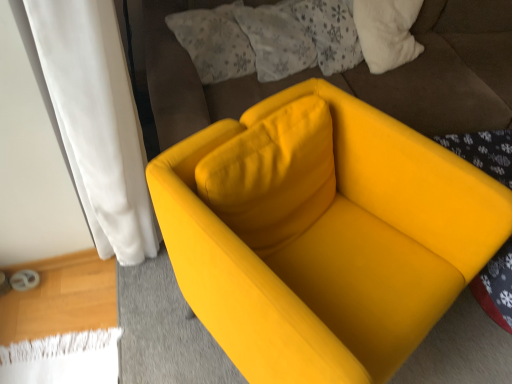
The width and height of the screenshot is (512, 384). I want to click on fluffy white pillow at upper center, the 1th pillow viewed from the right, so click(x=276, y=40).

Identify the location of matte yellow armchair at center. The width and height of the screenshot is (512, 384). (447, 71).

I want to click on fluffy white pillow at upper center, the 1th pillow viewed from the right, so click(276, 40).

Based on their sizes in the image, would you say matte yellow armchair at center is bigger or smaller than matte yellow armchair at center?

Clearly, matte yellow armchair at center is smaller in size than matte yellow armchair at center.

Which is behind, matte yellow armchair at center or matte yellow armchair at center?

matte yellow armchair at center.

Do you think matte yellow armchair at center is within matte yellow armchair at center, or outside of it?

matte yellow armchair at center is located beyond the bounds of matte yellow armchair at center.

Is point (358, 162) farther from camera compared to point (144, 35)?

No, (358, 162) is closer to viewer.

Can you confirm if fluffy white pillow at upper center, placed as the 1th pillow when sorted from left to right, is bigger than matte yellow armchair at center?

Incorrect, fluffy white pillow at upper center, placed as the 1th pillow when sorted from left to right, is not larger than matte yellow armchair at center.

Is fluffy white pillow at upper center, placed as the 1th pillow when sorted from left to right, looking in the opposite direction of matte yellow armchair at center?

No, fluffy white pillow at upper center, placed as the 1th pillow when sorted from left to right,'s orientation is not away from matte yellow armchair at center.

Is matte yellow armchair at center inside fluffy white pillow at upper center, marked as the second pillow in a right-to-left arrangement?

Actually, matte yellow armchair at center is outside fluffy white pillow at upper center, marked as the second pillow in a right-to-left arrangement.

From a real-world perspective, does matte yellow armchair at center stand above fluffy white pillow at upper center, the 1th pillow viewed from the right?

Actually, matte yellow armchair at center is physically below fluffy white pillow at upper center, the 1th pillow viewed from the right, in the real world.

From the image's perspective, is matte yellow armchair at center located above or below fluffy white pillow at upper center, the 2th pillow from the left?

matte yellow armchair at center is below fluffy white pillow at upper center, the 2th pillow from the left.

Does matte yellow armchair at center turn towards fluffy white pillow at upper center, the 2th pillow from the left?

No, matte yellow armchair at center is not turned towards fluffy white pillow at upper center, the 2th pillow from the left.

Considering the positions of objects matte yellow armchair at center and fluffy white pillow at upper center, the 2th pillow from the left, in the image provided, who is more to the left, matte yellow armchair at center or fluffy white pillow at upper center, the 2th pillow from the left,?

fluffy white pillow at upper center, the 2th pillow from the left.

Is matte yellow armchair at center aimed at fluffy white pillow at upper center, the 1th pillow viewed from the right?

Yes, matte yellow armchair at center is aimed at fluffy white pillow at upper center, the 1th pillow viewed from the right.

Measure the distance from matte yellow armchair at center to fluffy white pillow at upper center, the 2th pillow from the left.

The distance of matte yellow armchair at center from fluffy white pillow at upper center, the 2th pillow from the left, is 10.62 inches.

Are matte yellow armchair at center and fluffy white pillow at upper center, the 1th pillow viewed from the right, located far from each other?

No, matte yellow armchair at center is in close proximity to fluffy white pillow at upper center, the 1th pillow viewed from the right.

How many degrees apart are the facing directions of matte yellow armchair at center and fluffy white pillow at upper center, placed as the 1th pillow when sorted from left to right?

matte yellow armchair at center and fluffy white pillow at upper center, placed as the 1th pillow when sorted from left to right, are facing 20.8 degrees away from each other.

Between matte yellow armchair at center and fluffy white pillow at upper center, placed as the 1th pillow when sorted from left to right, which one has larger width?

With larger width is matte yellow armchair at center.

At what (x,y) coordinates should I click in order to perform the action: click on bedding below the fluffy white pillow at upper center, placed as the 1th pillow when sorted from left to right (from the image's perspective). Please return your answer as a coordinate pair (x, y). Looking at the image, I should click on (447, 71).

Which of these two, matte yellow armchair at center or fluffy white pillow at upper center, marked as the second pillow in a right-to-left arrangement, stands taller?

matte yellow armchair at center.

Does fluffy white pillow at upper center, the 1th pillow viewed from the right, have a lesser width compared to matte yellow armchair at center?

Yes.

From the image's perspective, is fluffy white pillow at upper center, the 1th pillow viewed from the right, under matte yellow armchair at center?

No, from the image's perspective, fluffy white pillow at upper center, the 1th pillow viewed from the right, is not beneath matte yellow armchair at center.

Is fluffy white pillow at upper center, the 1th pillow viewed from the right, positioned with its back to matte yellow armchair at center?

Correct, fluffy white pillow at upper center, the 1th pillow viewed from the right, is looking away from matte yellow armchair at center.

Is fluffy white pillow at upper center, placed as the 1th pillow when sorted from left to right, positioned with its back to matte yellow armchair at center?

Yes.

Who is bigger, fluffy white pillow at upper center, placed as the 1th pillow when sorted from left to right, or matte yellow armchair at center?

With larger size is matte yellow armchair at center.

Does point (184, 15) appear closer or farther from the camera than point (493, 39)?

Point (184, 15) is closer to the camera than point (493, 39).

Does fluffy white pillow at upper center, placed as the 1th pillow when sorted from left to right, have a lesser width compared to matte yellow armchair at center?

Yes, fluffy white pillow at upper center, placed as the 1th pillow when sorted from left to right, is thinner than matte yellow armchair at center.

Find the location of `bedding behind the matte yellow armchair at center`. bedding behind the matte yellow armchair at center is located at coordinates (447, 71).

Locate an element on the screen. the 2nd pillow to the left when counting from the matte yellow armchair at center is located at coordinates pyautogui.click(x=214, y=42).

Based on their spatial positions, is fluffy white pillow at upper center, the 1th pillow viewed from the right, or matte yellow armchair at center further from matte yellow armchair at center?

matte yellow armchair at center is further to matte yellow armchair at center.

When comparing their distances from matte yellow armchair at center, does matte yellow armchair at center or fluffy white pillow at upper center, placed as the 1th pillow when sorted from left to right, seem further?

The object further to matte yellow armchair at center is fluffy white pillow at upper center, placed as the 1th pillow when sorted from left to right.

Which object lies nearer to the anchor point fluffy white pillow at upper center, the 1th pillow viewed from the right, matte yellow armchair at center or fluffy white pillow at upper center, marked as the second pillow in a right-to-left arrangement?

fluffy white pillow at upper center, marked as the second pillow in a right-to-left arrangement.

When comparing their distances from fluffy white pillow at upper center, the 1th pillow viewed from the right, does fluffy white pillow at upper center, placed as the 1th pillow when sorted from left to right, or matte yellow armchair at center seem closer?

Among the two, fluffy white pillow at upper center, placed as the 1th pillow when sorted from left to right, is located nearer to fluffy white pillow at upper center, the 1th pillow viewed from the right.

Looking at the image, which one is located further to fluffy white pillow at upper center, marked as the second pillow in a right-to-left arrangement, matte yellow armchair at center or matte yellow armchair at center?

matte yellow armchair at center.

Looking at the image, which one is located closer to fluffy white pillow at upper center, marked as the second pillow in a right-to-left arrangement, matte yellow armchair at center or fluffy white pillow at upper center, the 1th pillow viewed from the right?

Among the two, fluffy white pillow at upper center, the 1th pillow viewed from the right, is located nearer to fluffy white pillow at upper center, marked as the second pillow in a right-to-left arrangement.

When comparing their distances from fluffy white pillow at upper center, the 1th pillow viewed from the right, does matte yellow armchair at center or matte yellow armchair at center seem closer?

matte yellow armchair at center lies closer to fluffy white pillow at upper center, the 1th pillow viewed from the right, than the other object.

Based on their spatial positions, is matte yellow armchair at center or fluffy white pillow at upper center, the 1th pillow viewed from the right, further from matte yellow armchair at center?

Among the two, matte yellow armchair at center is located further to matte yellow armchair at center.

Locate an element on the screen. pillow situated between fluffy white pillow at upper center, marked as the second pillow in a right-to-left arrangement, and matte yellow armchair at center from left to right is located at coordinates (276, 40).

Where is `bedding between fluffy white pillow at upper center, marked as the second pillow in a right-to-left arrangement, and matte yellow armchair at center from top to bottom`? The width and height of the screenshot is (512, 384). bedding between fluffy white pillow at upper center, marked as the second pillow in a right-to-left arrangement, and matte yellow armchair at center from top to bottom is located at coordinates (447, 71).

At what (x,y) coordinates should I click in order to perform the action: click on pillow between matte yellow armchair at center and fluffy white pillow at upper center, the 2th pillow from the left, along the z-axis. Please return your answer as a coordinate pair (x, y). Looking at the image, I should click on (214, 42).

The image size is (512, 384). I want to click on bedding between fluffy white pillow at upper center, the 2th pillow from the left, and matte yellow armchair at center vertically, so click(447, 71).